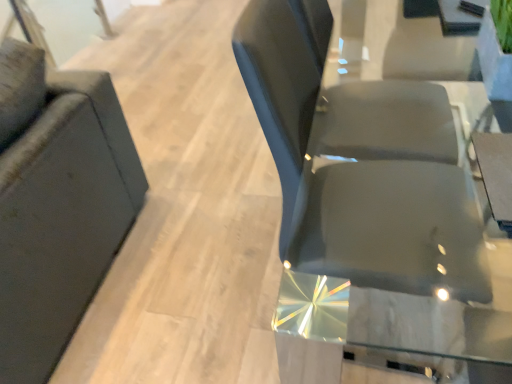
Question: From the image's perspective, relative to transparent glass door at upper left, is matte black chair at left, which appears as the 2th chair when viewed from the right, above or below?

Choices:
 (A) above
 (B) below

Answer: (B)

Question: Is matte black chair at left, which is counted as the first chair, starting from the left, bigger or smaller than transparent glass door at upper left?

Choices:
 (A) small
 (B) big

Answer: (B)

Question: Estimate the real-world distances between objects in this image. Which object is farther from the glossy black chair at center, marked as the first chair in a right-to-left arrangement?

Choices:
 (A) matte black chair at left, which appears as the 2th chair when viewed from the right
 (B) transparent glass door at upper left

Answer: (B)

Question: Estimate the real-world distances between objects in this image. Which object is farther from the transparent glass door at upper left?

Choices:
 (A) glossy black chair at center, marked as the first chair in a right-to-left arrangement
 (B) matte black chair at left, which appears as the 2th chair when viewed from the right

Answer: (A)